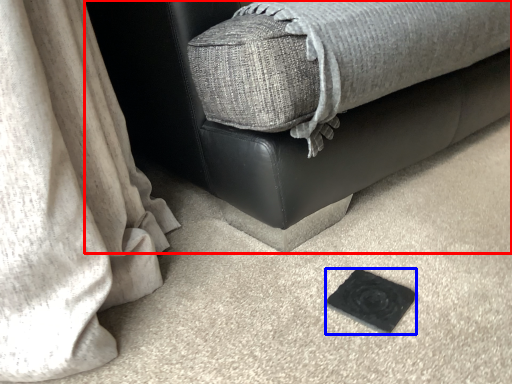
Question: Which object is further to the camera taking this photo, furniture (highlighted by a red box) or pad (highlighted by a blue box)?

Choices:
 (A) furniture
 (B) pad

Answer: (B)